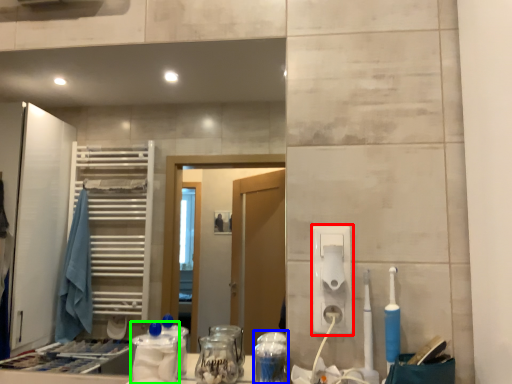
Question: Which is farther away from hand dryer (highlighted by a red box)? glass jar (highlighted by a blue box) or bottle (highlighted by a green box)?

Choices:
 (A) glass jar
 (B) bottle

Answer: (B)